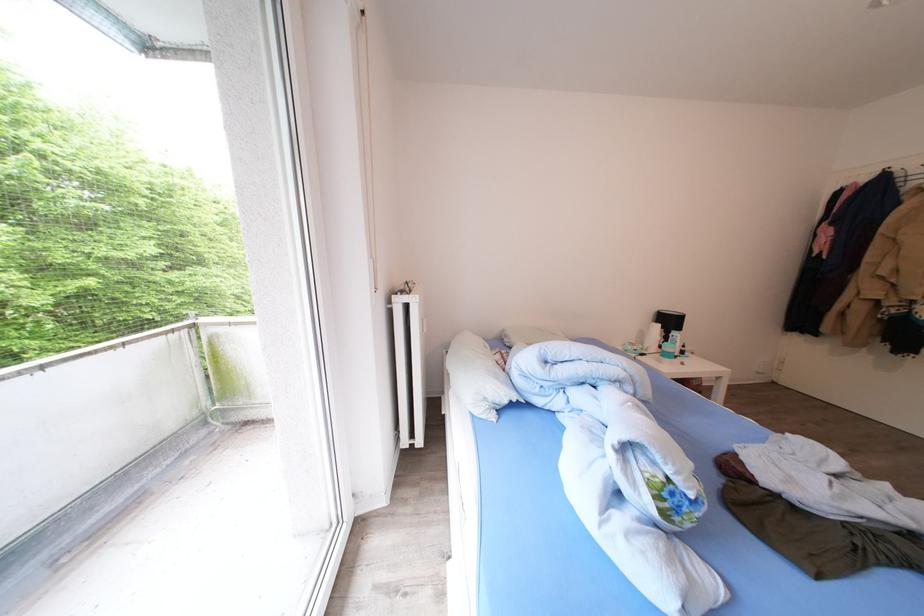
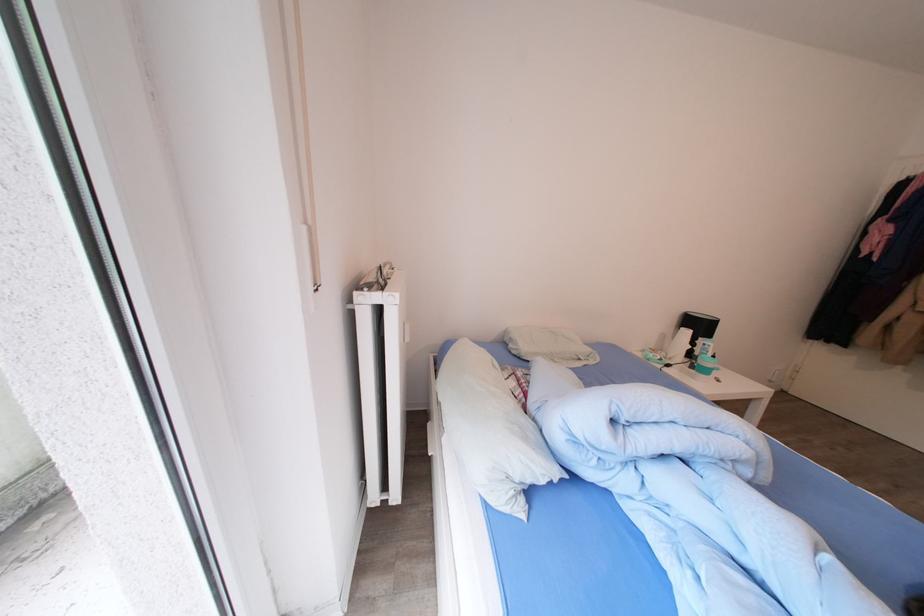
Question: What movement of the cameraman would produce the second image?

Choices:
 (A) Left
 (B) Right
 (C) Forward
 (D) Backward

Answer: (C)